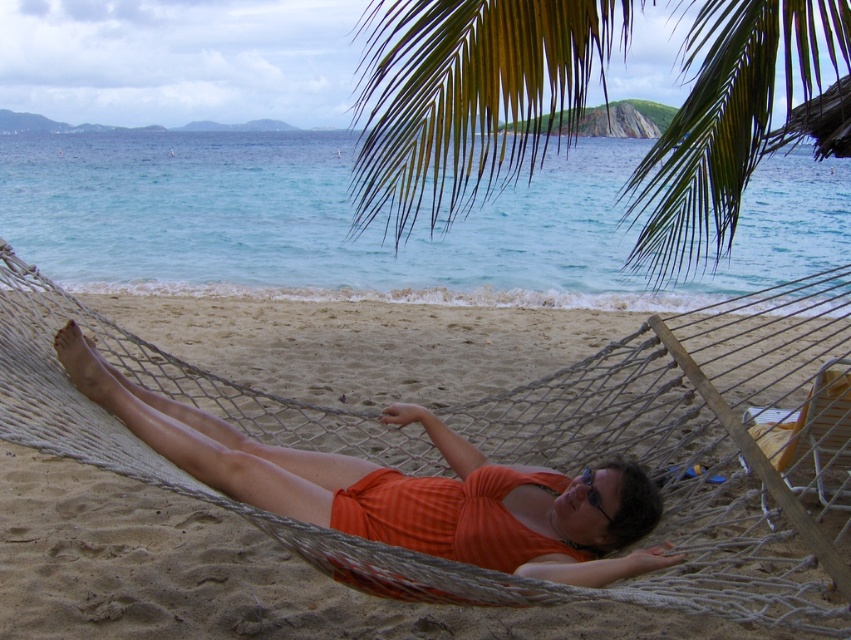
Question: Observing the image, what is the correct spatial positioning of green leafy palm tree at upper center in reference to orange fabric hammock at center?

Choices:
 (A) right
 (B) left

Answer: (A)

Question: Among these objects, which one is nearest to the camera?

Choices:
 (A) orange fabric hammock at center
 (B) transparent plastic goggles at center
 (C) green leafy palm tree at upper center

Answer: (C)

Question: Considering the relative positions of green leafy palm tree at upper center and transparent plastic goggles at center in the image provided, where is green leafy palm tree at upper center located with respect to transparent plastic goggles at center?

Choices:
 (A) below
 (B) above

Answer: (B)

Question: Among these points, which one is nearest to the camera?

Choices:
 (A) (505, 36)
 (B) (184, 449)

Answer: (B)

Question: Which object is positioned closest to the green leafy palm tree at upper center?

Choices:
 (A) transparent plastic goggles at center
 (B) orange fabric hammock at center

Answer: (B)

Question: Is green leafy palm tree at upper center to the right of transparent plastic goggles at center from the viewer's perspective?

Choices:
 (A) yes
 (B) no

Answer: (A)